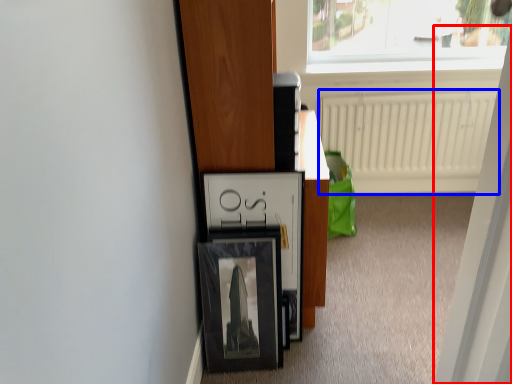
Question: Which of the following is the closest to the observer, screen door (highlighted by a red box) or radiator (highlighted by a blue box)?

Choices:
 (A) screen door
 (B) radiator

Answer: (A)